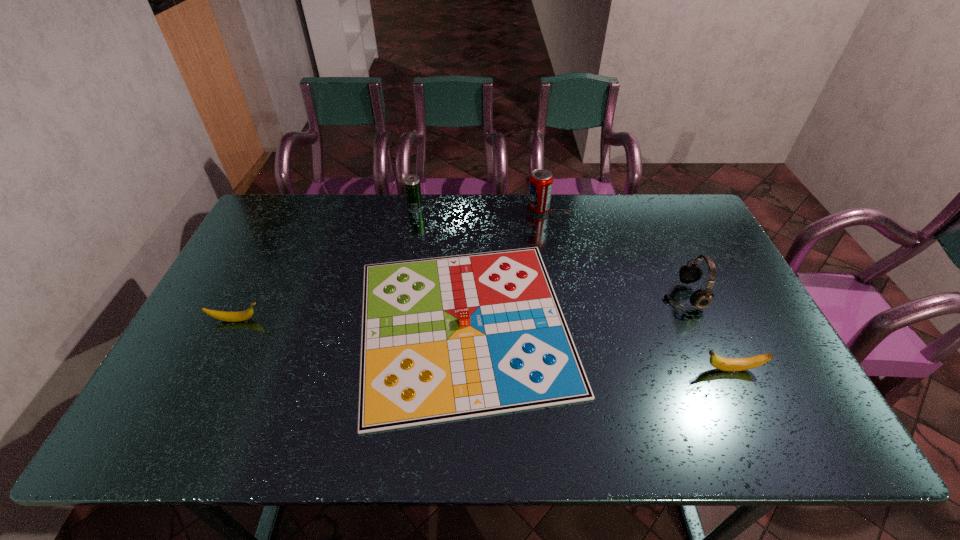
Locate an element on the screen. Image resolution: width=960 pixels, height=540 pixels. soda can is located at coordinates (541, 180).

At what (x,y) coordinates should I click in order to perform the action: click on headset. Please return your answer as a coordinate pair (x, y). Image resolution: width=960 pixels, height=540 pixels. Looking at the image, I should click on (690, 273).

I want to click on the third tallest object, so click(x=412, y=183).

Find the location of a particular element. This screenshot has width=960, height=540. the nearer banana is located at coordinates [x=725, y=364].

Identify the location of the left banana. This screenshot has height=540, width=960. (220, 315).

The image size is (960, 540). Identify the location of the leftmost object. (220, 315).

This screenshot has width=960, height=540. I want to click on the shortest object, so click(446, 338).

At what (x,y) coordinates should I click in order to perform the action: click on vacant space situated 0.290m on the right of the soda can. Please return your answer as a coordinate pair (x, y). The image size is (960, 540). Looking at the image, I should click on (632, 210).

Locate an element on the screen. vacant space located 0.120m with the microphone on the side of the headset is located at coordinates (620, 296).

You are a GUI agent. You are given a task and a screenshot of the screen. Output one action in this format:
    pyautogui.click(x=<x>, y=<y>)
    Task: Click on the free location located with the microphone on the side of the headset
    Image resolution: width=960 pixels, height=540 pixels.
    Given the screenshot: What is the action you would take?
    pyautogui.click(x=644, y=296)